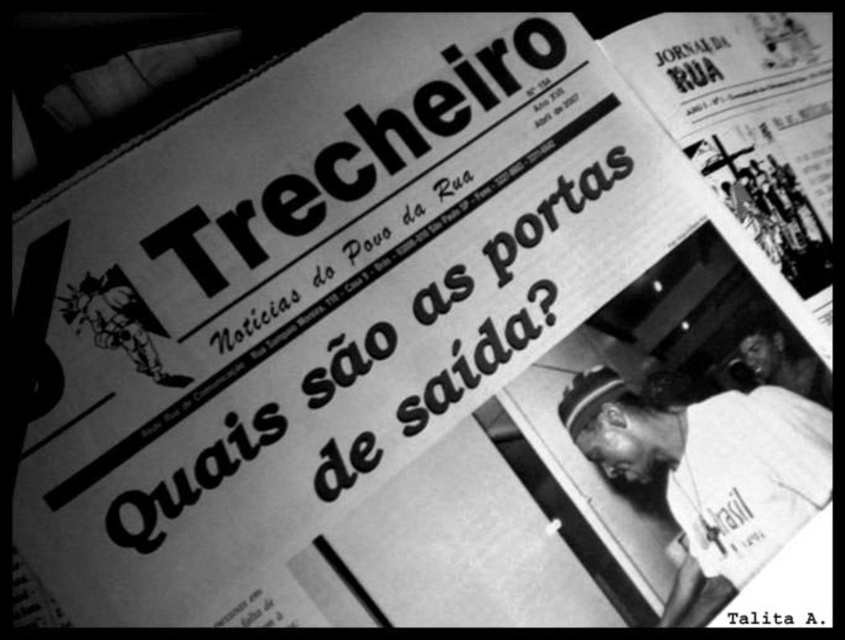
You are a detective examining a crime scene photo. In the image, there is a white fabric cap at center. Based on its coordinates, can you determine if it is located in the lower half of the image?

The white fabric cap at center is located at coordinates point [710,472]. Since the y coordinate is 0.841, which is above 0.5, it is in the upper half of the image.

You are a detective examining the newspaper. You notice two items in the image. One is the white fabric cap at center and the other is the smooth skin face at lower right. Based on their positions, which item is more likely to be covering the headline text?

The white fabric cap at center might be wider than smooth skin face at lower right, so it is more likely to be covering the headline text.

From the picture: You are a detective examining the newspaper photo. You notice two features on the image. One is the white fabric cap at center and the other is the smooth skin face at lower right. Which of these two items is located more to the left in the photo?

The white fabric cap at center is positioned on the left side of smooth skin face at lower right, so the white fabric cap at center is more to the left.